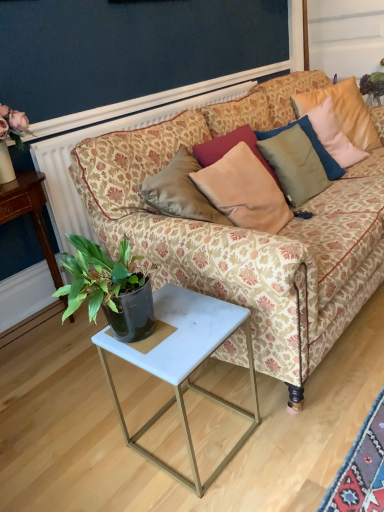
Locate an element on the screen. The image size is (384, 512). empty space that is ontop of white marble side table at lower center (from a real-world perspective) is located at coordinates (179, 328).